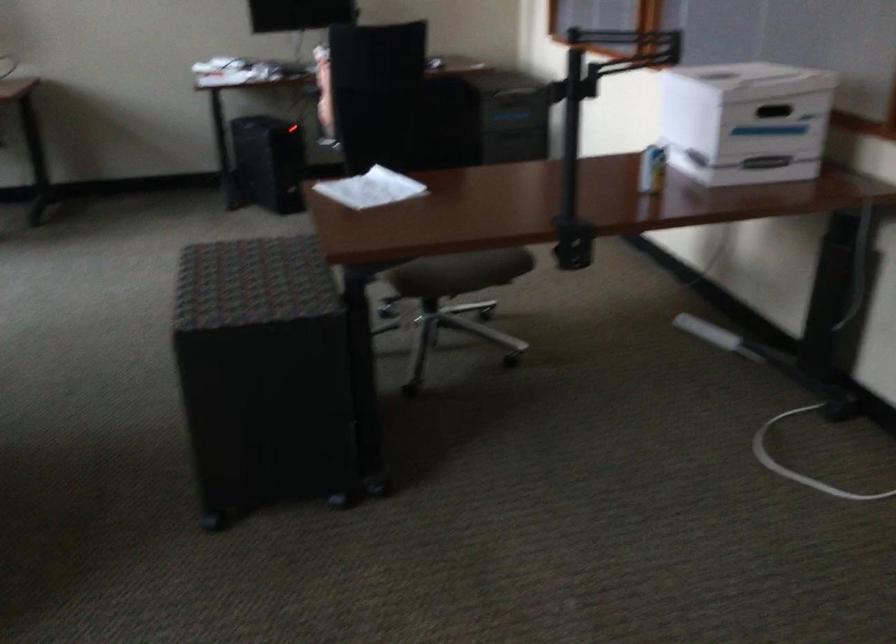
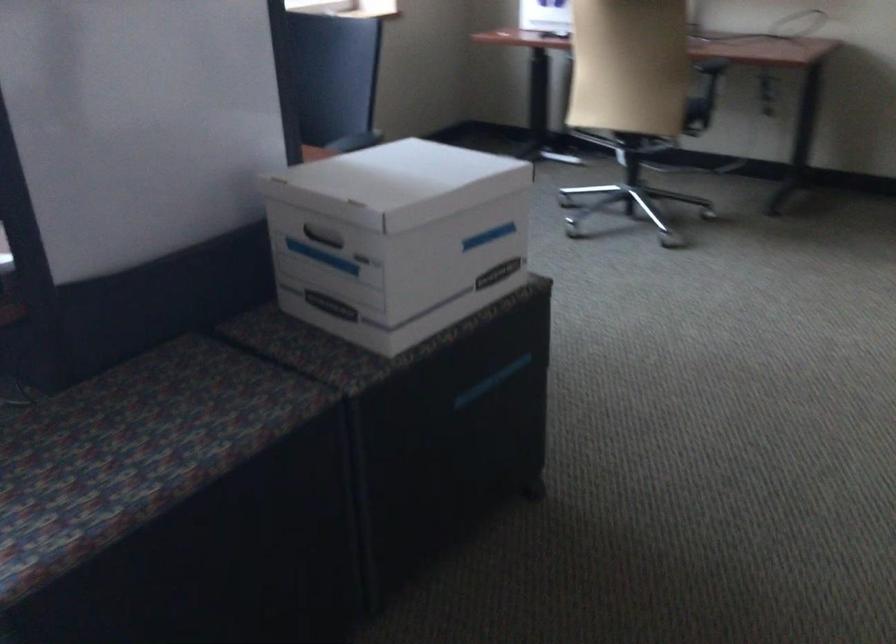
Question: The camera is either moving clockwise (left) or counter-clockwise (right) around the object. The first image is from the beginning of the video and the second image is from the end. Is the camera moving left or right when shooting the video?

Choices:
 (A) Left
 (B) Right

Answer: (B)